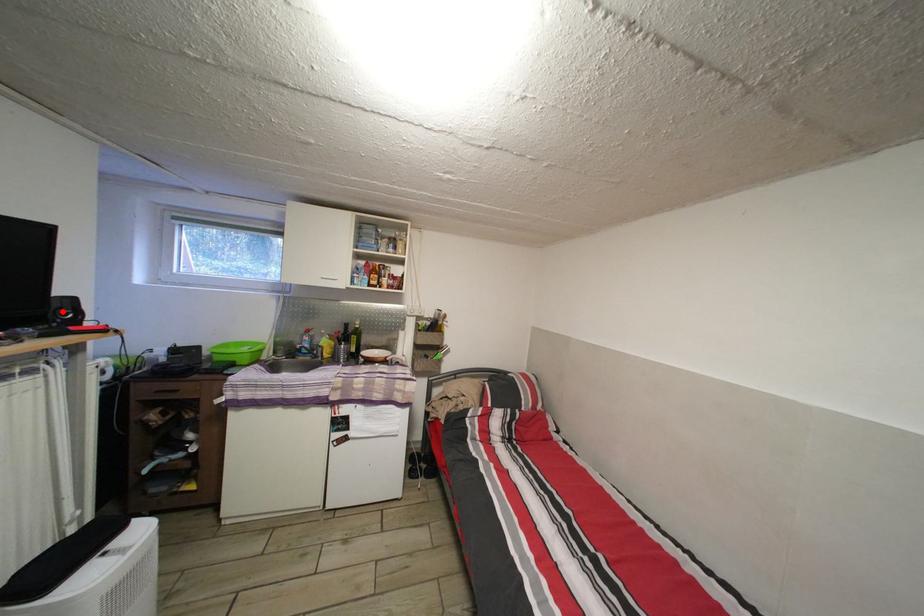
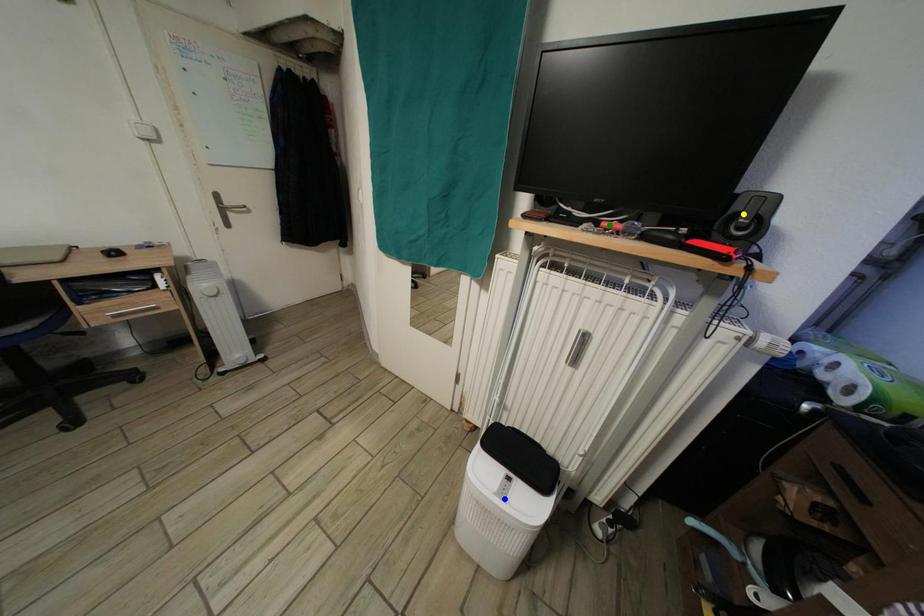
Question: I am providing you with two images of the same scene from different viewpoints. A red point is marked on the first image. You are given multiple points on the second image. Which point in image 2 represents the same 3d spot as the red point in image 1?

Choices:
 (A) yellow point
 (B) green point
 (C) blue point

Answer: (A)